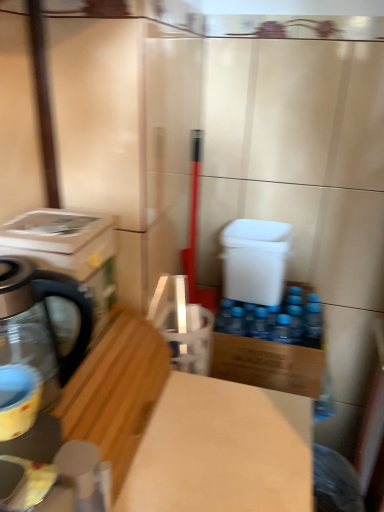
Locate an element on the screen. free location to the right of wooden cutting board at lower left is located at coordinates (215, 438).